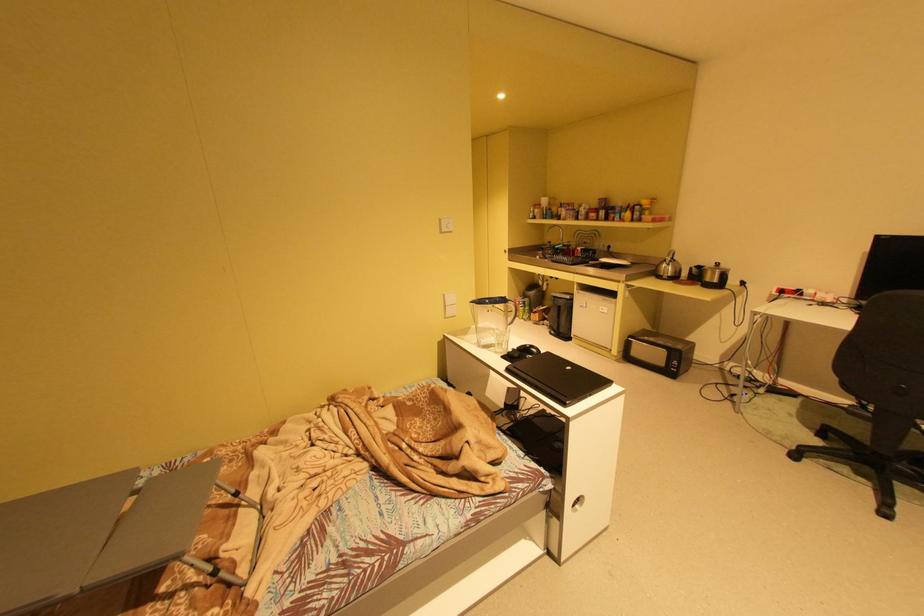
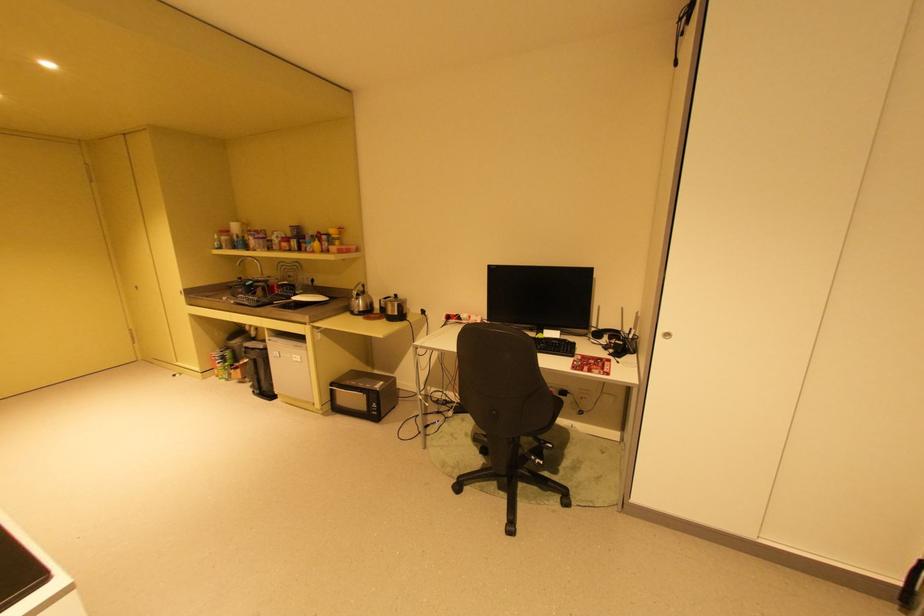
In the second image, find the point that corresponds to the point at 723,282 in the first image.

(404, 314)